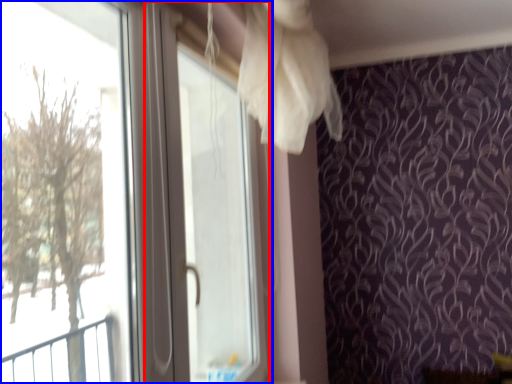
Question: Which object is further to the camera taking this photo, screen door (highlighted by a red box) or window (highlighted by a blue box)?

Choices:
 (A) screen door
 (B) window

Answer: (A)